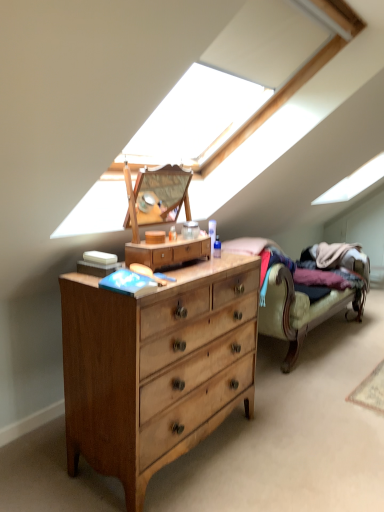
Question: Is velvet beige couch at right taller than light brown wood dresser at center?

Choices:
 (A) yes
 (B) no

Answer: (A)

Question: Is velvet beige couch at right positioned far away from light brown wood dresser at center?

Choices:
 (A) no
 (B) yes

Answer: (A)

Question: Is velvet beige couch at right in contact with light brown wood dresser at center?

Choices:
 (A) yes
 (B) no

Answer: (B)

Question: Is velvet beige couch at right at the left side of light brown wood dresser at center?

Choices:
 (A) no
 (B) yes

Answer: (A)

Question: Is velvet beige couch at right smaller than light brown wood dresser at center?

Choices:
 (A) no
 (B) yes

Answer: (A)

Question: In the image, is velvet beige couch at right on the left side or the right side of light wood chest of drawers at center?

Choices:
 (A) left
 (B) right

Answer: (B)

Question: From a real-world perspective, relative to light wood chest of drawers at center, is velvet beige couch at right vertically above or below?

Choices:
 (A) above
 (B) below

Answer: (B)

Question: In terms of size, does velvet beige couch at right appear bigger or smaller than light wood chest of drawers at center?

Choices:
 (A) small
 (B) big

Answer: (B)

Question: From the image's perspective, is velvet beige couch at right above or below light wood chest of drawers at center?

Choices:
 (A) above
 (B) below

Answer: (A)

Question: From the image's perspective, is light brown wood dresser at center located above or below light wood chest of drawers at center?

Choices:
 (A) above
 (B) below

Answer: (A)

Question: Would you say light brown wood dresser at center is inside or outside light wood chest of drawers at center?

Choices:
 (A) inside
 (B) outside

Answer: (B)

Question: In terms of height, does light brown wood dresser at center look taller or shorter compared to light wood chest of drawers at center?

Choices:
 (A) short
 (B) tall

Answer: (A)

Question: Considering the positions of light brown wood dresser at center and light wood chest of drawers at center in the image, is light brown wood dresser at center bigger or smaller than light wood chest of drawers at center?

Choices:
 (A) big
 (B) small

Answer: (B)

Question: Considering their positions, is light wood chest of drawers at center located in front of or behind light brown wood dresser at center?

Choices:
 (A) behind
 (B) front

Answer: (B)

Question: From a real-world perspective, is light wood chest of drawers at center physically located above or below light brown wood dresser at center?

Choices:
 (A) below
 (B) above

Answer: (A)